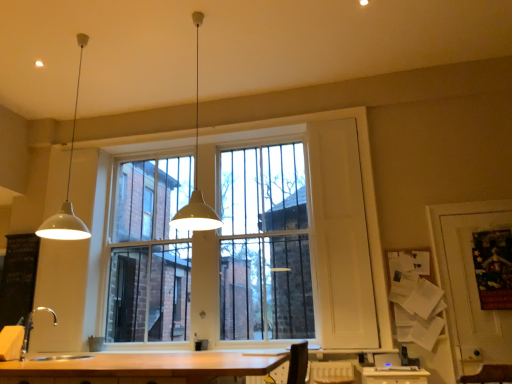
Question: Could you tell me if white glass window at center is facing white matte pendant light at center, marked as the first lamp in a right-to-left arrangement?

Choices:
 (A) no
 (B) yes

Answer: (B)

Question: Is white glass window at center in contact with white matte pendant light at center, marked as the first lamp in a right-to-left arrangement?

Choices:
 (A) no
 (B) yes

Answer: (A)

Question: Can you confirm if white glass window at center is taller than white matte pendant light at center, the second lamp in the left-to-right sequence?

Choices:
 (A) yes
 (B) no

Answer: (A)

Question: Is white glass window at center to the left of white matte pendant light at center, the second lamp in the left-to-right sequence, from the viewer's perspective?

Choices:
 (A) yes
 (B) no

Answer: (A)

Question: From a real-world perspective, is white glass window at center on white matte pendant light at center, marked as the first lamp in a right-to-left arrangement?

Choices:
 (A) yes
 (B) no

Answer: (B)

Question: In the image, is white matte pendant light at upper left, which is counted as the first lamp, starting from the left, positioned in front of or behind white glass window at center?

Choices:
 (A) front
 (B) behind

Answer: (A)

Question: Is white matte pendant light at upper left, placed as the 2th lamp when sorted from right to left, inside or outside of white glass window at center?

Choices:
 (A) inside
 (B) outside

Answer: (B)

Question: Is white matte pendant light at upper left, which is counted as the first lamp, starting from the left, wider or thinner than white glass window at center?

Choices:
 (A) wide
 (B) thin

Answer: (A)

Question: From the image's perspective, is white matte pendant light at upper left, placed as the 2th lamp when sorted from right to left, above or below white glass window at center?

Choices:
 (A) above
 (B) below

Answer: (A)

Question: Looking at their shapes, would you say white matte pendant light at center, the second lamp in the left-to-right sequence, is wider or thinner than black chalkboard at left?

Choices:
 (A) wide
 (B) thin

Answer: (A)

Question: Is white matte pendant light at center, the second lamp in the left-to-right sequence, bigger or smaller than black chalkboard at left?

Choices:
 (A) small
 (B) big

Answer: (B)

Question: Considering their positions, is white matte pendant light at center, the second lamp in the left-to-right sequence, located in front of or behind black chalkboard at left?

Choices:
 (A) behind
 (B) front

Answer: (B)

Question: Is white matte pendant light at center, marked as the first lamp in a right-to-left arrangement, taller or shorter than black chalkboard at left?

Choices:
 (A) tall
 (B) short

Answer: (A)

Question: Is white matte pendant light at upper left, which is counted as the first lamp, starting from the left, in front of or behind silver metallic faucet at lower left in the image?

Choices:
 (A) behind
 (B) front

Answer: (A)

Question: Is white matte pendant light at upper left, which is counted as the first lamp, starting from the left, bigger or smaller than silver metallic faucet at lower left?

Choices:
 (A) small
 (B) big

Answer: (B)